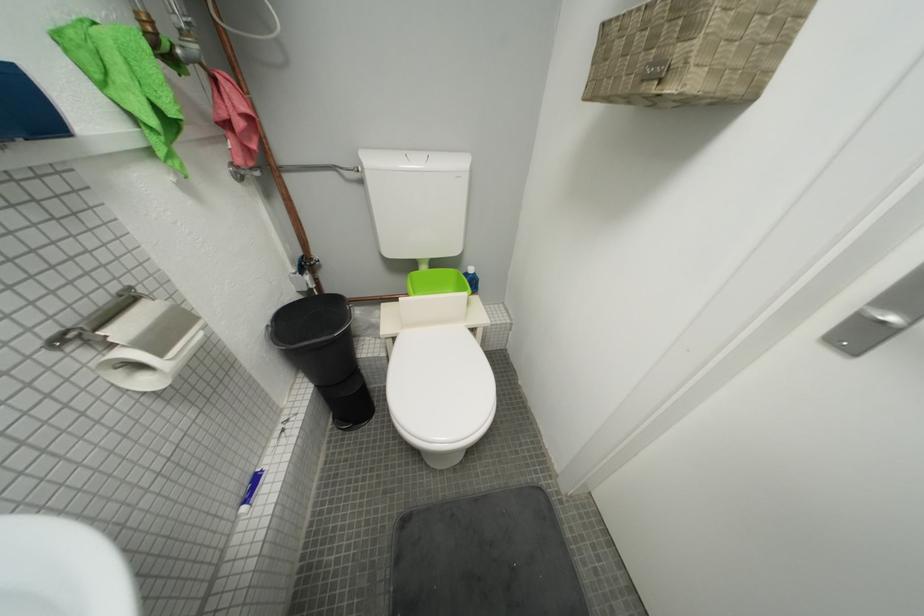
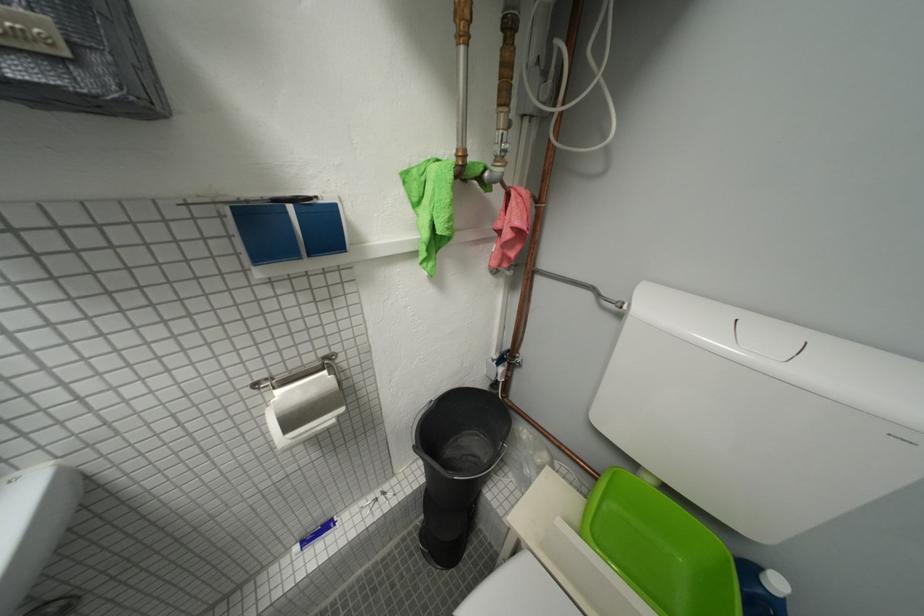
Question: The first image is from the beginning of the video and the second image is from the end. How did the camera likely rotate when shooting the video?

Choices:
 (A) Left
 (B) Right
 (C) Up
 (D) Down

Answer: (A)